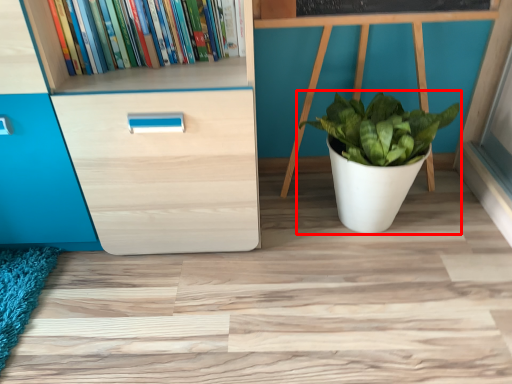
Question: Observing the image, what is the correct spatial positioning of houseplant (annotated by the red box) in reference to book?

Choices:
 (A) left
 (B) right

Answer: (B)